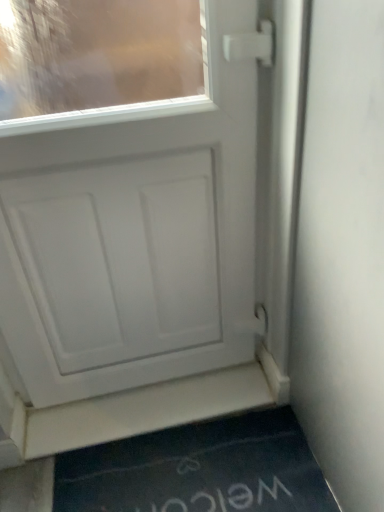
Locate an element on the screen. Image resolution: width=384 pixels, height=512 pixels. white matte door at lower center is located at coordinates (144, 410).

Measure the distance between white matte door at center and camera.

34.86 inches.

The height and width of the screenshot is (512, 384). What do you see at coordinates (198, 470) in the screenshot? I see `dark blue rubber doormat at lower center` at bounding box center [198, 470].

Identify the location of white matte door at lower center. (144, 410).

Does dark blue rubber doormat at lower center turn towards white matte door at center?

No, dark blue rubber doormat at lower center is not aimed at white matte door at center.

Considering the sizes of objects dark blue rubber doormat at lower center and white matte door at center in the image provided, who is wider, dark blue rubber doormat at lower center or white matte door at center?

dark blue rubber doormat at lower center is wider.

Is dark blue rubber doormat at lower center located outside white matte door at center?

Yes.

How many degrees apart are the facing directions of dark blue rubber doormat at lower center and white matte door at center?

0.793 degrees separate the facing orientations of dark blue rubber doormat at lower center and white matte door at center.

Could you tell me if white matte door at center is facing white matte door at lower center?

No, white matte door at center is not facing towards white matte door at lower center.

What are the coordinates of `stairwell behind the white matte door at center` in the screenshot? It's located at (144, 410).

From the image's perspective, is white matte door at center on white matte door at lower center?

Indeed, from the image's perspective, white matte door at center is shown above white matte door at lower center.

Is white matte door at center next to white matte door at lower center?

white matte door at center and white matte door at lower center are not in contact.

How distant is white matte door at lower center from dark blue rubber doormat at lower center?

white matte door at lower center is 12.44 centimeters away from dark blue rubber doormat at lower center.

Which object is thinner, white matte door at lower center or dark blue rubber doormat at lower center?

With smaller width is white matte door at lower center.

Does white matte door at lower center have a greater height compared to dark blue rubber doormat at lower center?

Incorrect, the height of white matte door at lower center is not larger of that of dark blue rubber doormat at lower center.

Looking at this image, from a real-world perspective, is white matte door at lower center positioned above or below dark blue rubber doormat at lower center?

In terms of real-world spatial position, white matte door at lower center is above dark blue rubber doormat at lower center.

Between point (213, 462) and point (90, 417), which one is positioned behind?

Point (90, 417)

Choose the correct answer: Is dark blue rubber doormat at lower center inside white matte door at lower center or outside it?

dark blue rubber doormat at lower center cannot be found inside white matte door at lower center.

Considering the relative sizes of dark blue rubber doormat at lower center and white matte door at lower center in the image provided, is dark blue rubber doormat at lower center bigger than white matte door at lower center?

Indeed, dark blue rubber doormat at lower center has a larger size compared to white matte door at lower center.

Looking at this image, is dark blue rubber doormat at lower center far from white matte door at lower center?

dark blue rubber doormat at lower center is near white matte door at lower center, not far away.

Is white matte door at center shorter than dark blue rubber doormat at lower center?

In fact, white matte door at center may be taller than dark blue rubber doormat at lower center.

Would you consider white matte door at center to be distant from dark blue rubber doormat at lower center?

No.

Based on the photo, is white matte door at center positioned beyond the bounds of dark blue rubber doormat at lower center?

Absolutely, white matte door at center is external to dark blue rubber doormat at lower center.

The height and width of the screenshot is (512, 384). I want to click on doormat lying below the white matte door at center (from the image's perspective), so click(x=198, y=470).

Would you say white matte door at lower center is a long distance from white matte door at center?

Actually, white matte door at lower center and white matte door at center are a little close together.

Looking at this image, based on their sizes in the image, would you say white matte door at lower center is bigger or smaller than white matte door at center?

In the image, white matte door at lower center appears to be smaller than white matte door at center.

Who is taller, white matte door at lower center or white matte door at center?

With more height is white matte door at center.

Choose the correct answer: Is white matte door at lower center inside white matte door at center or outside it?

white matte door at lower center is not enclosed by white matte door at center.

Locate an element on the screen. The width and height of the screenshot is (384, 512). doormat below the white matte door at center (from the image's perspective) is located at coordinates (198, 470).

The image size is (384, 512). I want to click on door lying on the left of white matte door at lower center, so (132, 207).

When comparing their distances from white matte door at lower center, does white matte door at center or dark blue rubber doormat at lower center seem further?

Based on the image, white matte door at center appears to be further to white matte door at lower center.

When comparing their distances from white matte door at lower center, does dark blue rubber doormat at lower center or white matte door at center seem closer?

dark blue rubber doormat at lower center is positioned closer to the anchor white matte door at lower center.

When comparing their distances from white matte door at center, does white matte door at lower center or dark blue rubber doormat at lower center seem closer?

Based on the image, white matte door at lower center appears to be nearer to white matte door at center.

In the scene shown: Based on their spatial positions, is dark blue rubber doormat at lower center or white matte door at lower center further from white matte door at center?

Based on the image, dark blue rubber doormat at lower center appears to be further to white matte door at center.

When comparing their distances from dark blue rubber doormat at lower center, does white matte door at lower center or white matte door at center seem further?

white matte door at center is further to dark blue rubber doormat at lower center.

Looking at the image, which one is located further to dark blue rubber doormat at lower center, white matte door at center or white matte door at lower center?

white matte door at center is positioned further to the anchor dark blue rubber doormat at lower center.

What are the coordinates of `stairwell between white matte door at center and dark blue rubber doormat at lower center in the vertical direction` in the screenshot? It's located at (144, 410).